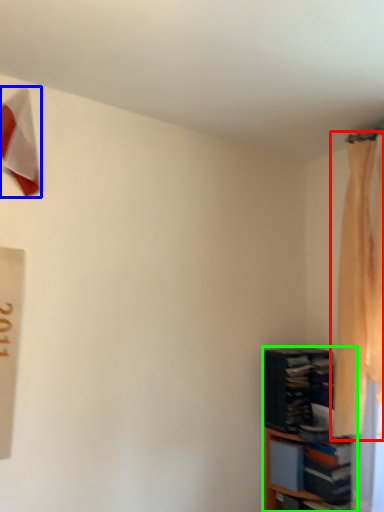
Question: Considering the real-world distances, which object is farthest from curtain (highlighted by a red box)? twin (highlighted by a blue box) or shelf (highlighted by a green box)?

Choices:
 (A) twin
 (B) shelf

Answer: (A)